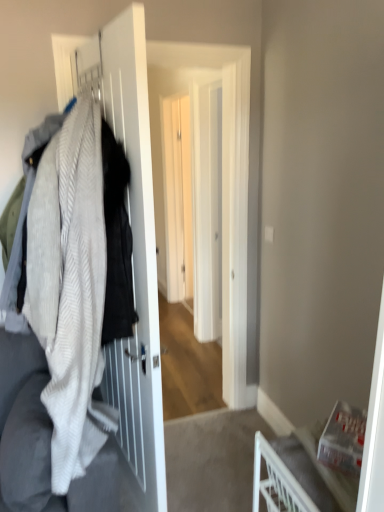
Question: From a real-world perspective, is white textured blanket at left above or below white matte screen door at left, which appears as the 2th screen door when viewed from the back?

Choices:
 (A) above
 (B) below

Answer: (A)

Question: Considering the positions of white textured blanket at left and white matte screen door at left, the first screen door from the front, in the image, is white textured blanket at left taller or shorter than white matte screen door at left, the first screen door from the front,?

Choices:
 (A) short
 (B) tall

Answer: (A)

Question: Which object is the farthest from the textured wool sweater at left?

Choices:
 (A) white matte screen door at left, which appears as the 2th screen door when viewed from the back
 (B) white glossy screen door at center, which is the 2th screen door in front-to-back order
 (C) white textured blanket at left
 (D) white plastic chair at lower right

Answer: (B)

Question: Estimate the real-world distances between objects in this image. Which object is closer to the white textured blanket at left?

Choices:
 (A) white matte screen door at left, which appears as the 2th screen door when viewed from the back
 (B) white glossy screen door at center, which is the 2th screen door in front-to-back order
 (C) white plastic chair at lower right
 (D) textured wool sweater at left

Answer: (A)